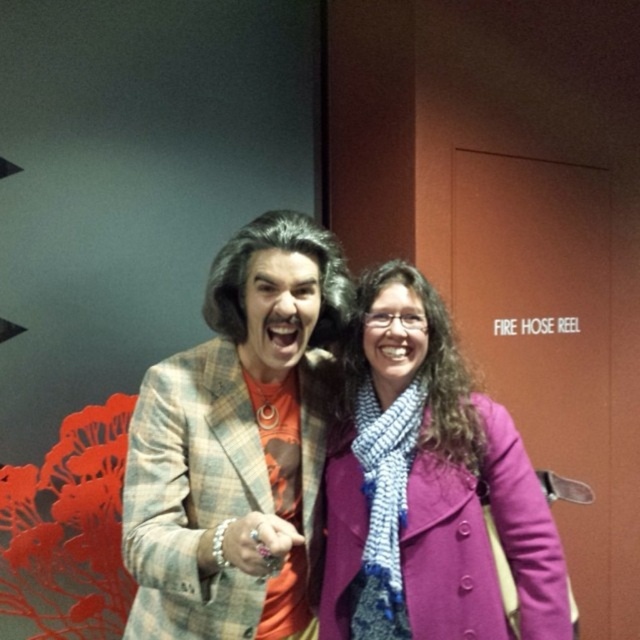
Question: Is plaid fabric jacket at center below purple woolen coat at center?

Choices:
 (A) yes
 (B) no

Answer: (B)

Question: Which point appears closest to the camera in this image?

Choices:
 (A) (285, 400)
 (B) (440, 346)

Answer: (B)

Question: Is plaid fabric jacket at center positioned before purple woolen coat at center?

Choices:
 (A) yes
 (B) no

Answer: (A)

Question: Can you confirm if plaid fabric jacket at center is positioned to the left of purple woolen coat at center?

Choices:
 (A) no
 (B) yes

Answer: (B)